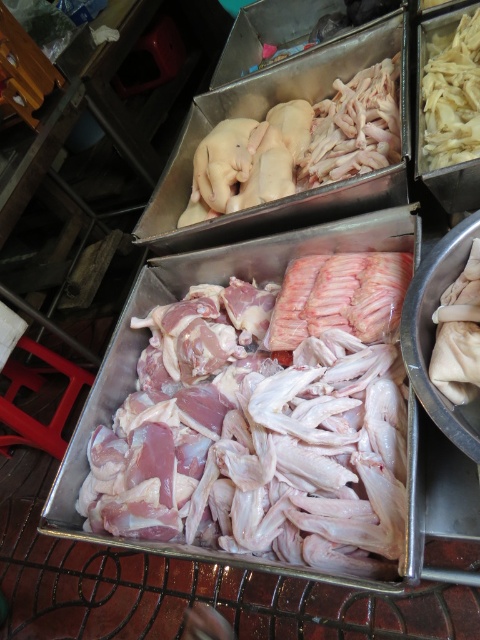
From the picture: You are a customer at the market stall and want to buy the pink raw meat at center and the white matte noodles at upper right. Which item is closer to the right edge of the stall?

The white matte noodles at upper right are closer to the right edge of the stall since the pink raw meat at center is to the left of them.

You are a food safety inspector checking the market stall. You notice the pink raw meat at center and the white matte noodles at upper right. According to food safety guidelines, raw meat must be stored below ready to eat items to prevent cross contamination. Is the current arrangement compliant with this rule?

The pink raw meat at center is much taller than the white matte noodles at upper right. Since the raw meat is taller, it could potentially drip contaminants onto the noodles below, violating the food safety guideline. The arrangement is not compliant.

You are a customer at the market stall and want to pick up the pale pink raw meat at upper center and the white matte noodles at upper right. Which item will you need to reach further back to grab?

The white matte noodles at upper right are further away from you, so you will need to reach further back to grab the white matte noodles at upper right.